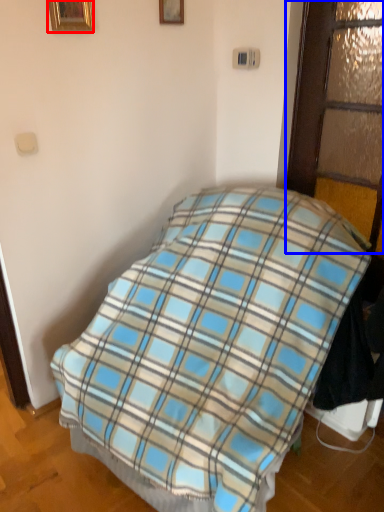
Question: Which object is further to the camera taking this photo, picture frame (highlighted by a red box) or glass door (highlighted by a blue box)?

Choices:
 (A) picture frame
 (B) glass door

Answer: (A)